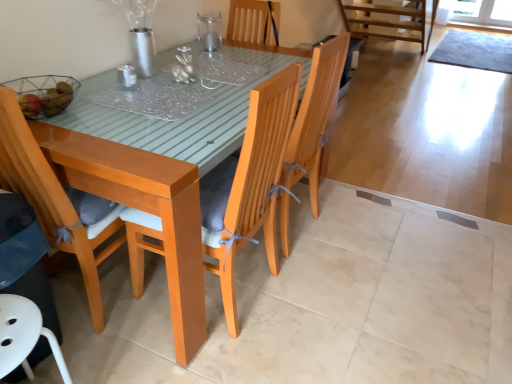
Locate an element on the screen. Image resolution: width=512 pixels, height=384 pixels. vacant position to the left of metallic silver candlestick at center, the second tableware when ordered from top to bottom is located at coordinates (101, 87).